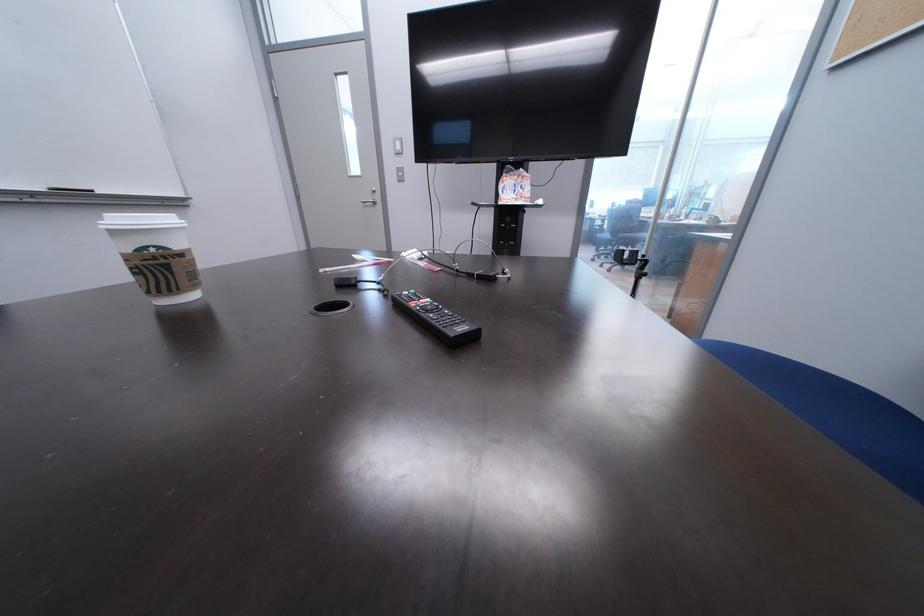
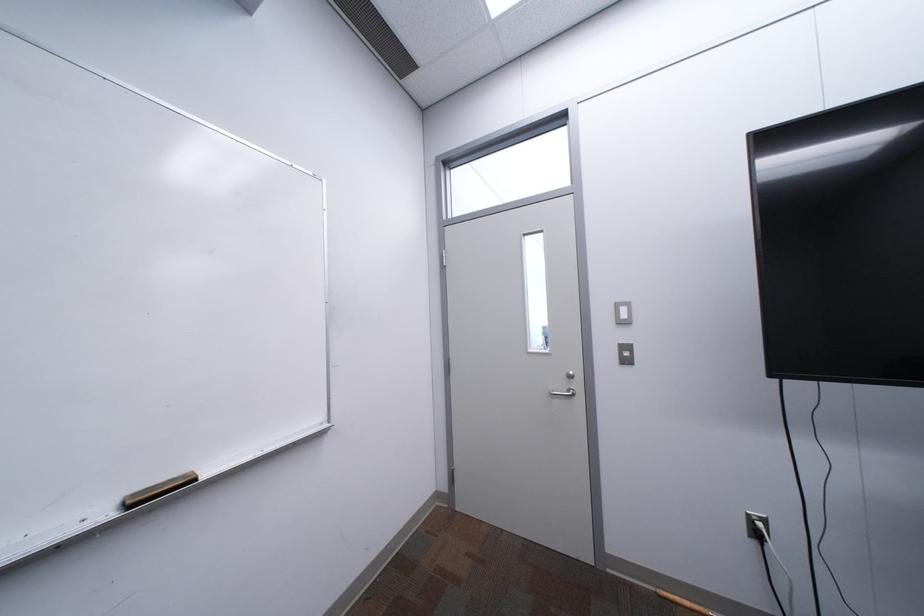
In a continuous first-person perspective shot, in which direction is the camera moving?

The cameraman moved toward left, forward.